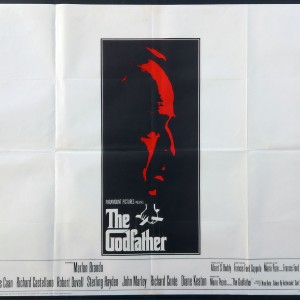
The image size is (300, 300). In order to click on movie poster in this screenshot , I will do `click(152, 186)`, `click(118, 89)`, `click(176, 64)`.